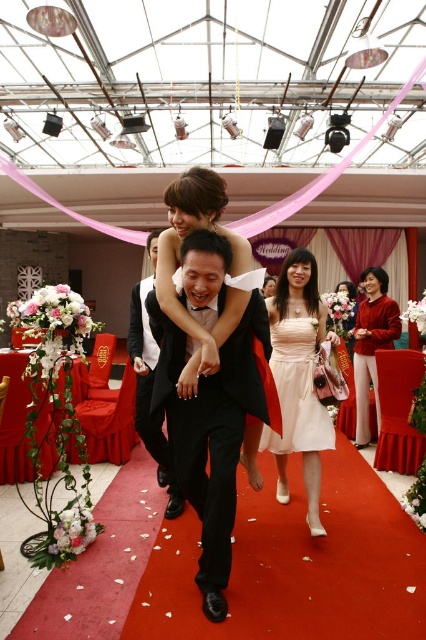
In the festive wedding scene, there is a black satin tuxedo at center and a matte red sweater at center. From the perspective of someone standing in front of the scene, which object is positioned to the left?

The black satin tuxedo at center is to the left of the matte red sweater at center.

You are a photographer at the wedding, and you need to capture a photo of both the black satin tuxedo at center and the pale pink satin dress at center. Which one should you focus on first to ensure both are in clear view?

You should focus on the black satin tuxedo at center first since it is closer to the viewer than the pale pink satin dress at center, ensuring both will be in clear view when focused properly.